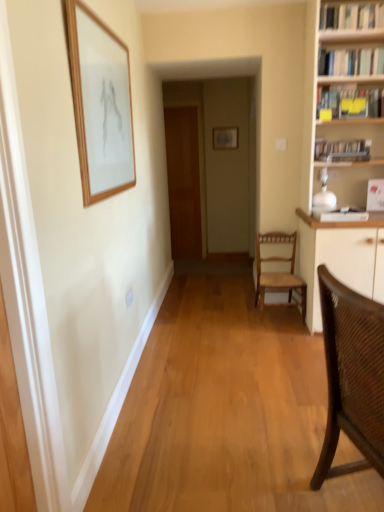
Question: In terms of height, does matte gray picture frame at center, which is the 2th picture frame in left-to-right order, look taller or shorter compared to white glossy bookshelf at upper right, which appears as the first book when viewed from the top?

Choices:
 (A) tall
 (B) short

Answer: (A)

Question: Considering their positions, is matte gray picture frame at center, marked as the first picture frame in a back-to-front arrangement, located in front of or behind white glossy bookshelf at upper right, which ranks as the fourth book in bottom-to-top order?

Choices:
 (A) behind
 (B) front

Answer: (A)

Question: Based on their relative distances, which object is farther from the hardcover book at upper right, which appears as the third book when viewed from the top?

Choices:
 (A) matte gray picture frame at center, which is the 2th picture frame in left-to-right order
 (B) brown woven chair at right, the second chair viewed from the back
 (C) wooden chair at center, the 2th chair in the front-to-back sequence
 (D) white glossy bookshelf at upper right, which ranks as the 3th book in bottom-to-top order
 (E) white glossy bookshelf at upper right, which appears as the first book when viewed from the top

Answer: (A)

Question: Which object is the closest to the wooden door at center?

Choices:
 (A) hardcover book at upper right, the 2th book from the bottom
 (B) hardcover books at upper right, positioned as the fourth book in top-to-bottom order
 (C) matte gray picture frame at center, the second picture frame in the bottom-to-top sequence
 (D) white glossy bookshelf at upper right, which ranks as the fourth book in bottom-to-top order
 (E) white glossy bookshelf at upper right, marked as the second book in a top-to-bottom arrangement

Answer: (C)